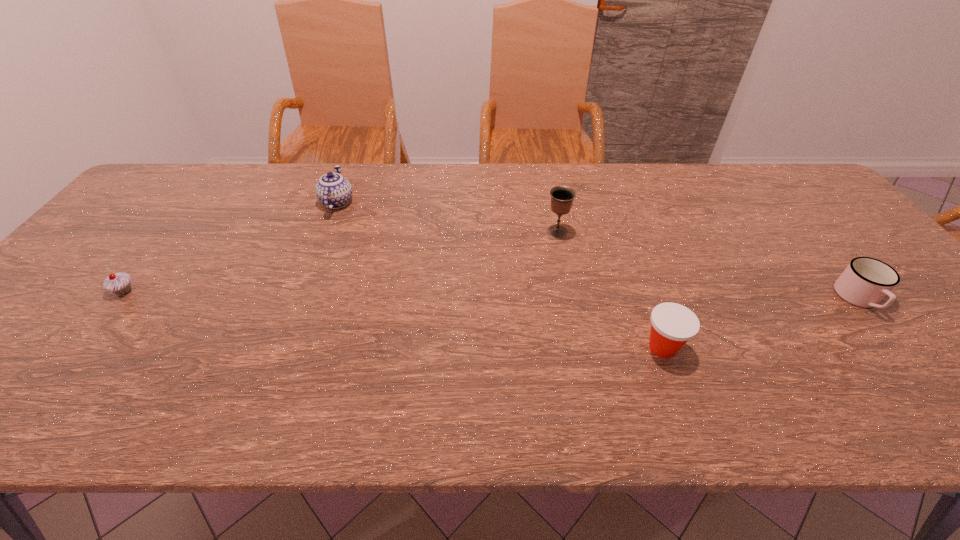
Where is `the third object from left to right`? Image resolution: width=960 pixels, height=540 pixels. the third object from left to right is located at coordinates (562, 197).

Locate an element on the screen. The width and height of the screenshot is (960, 540). the tallest object is located at coordinates (562, 197).

Identify the location of the second object from left to right. The width and height of the screenshot is (960, 540). (334, 191).

Identify the location of the farthest object. (334, 191).

The width and height of the screenshot is (960, 540). Find the location of `the nearest object`. the nearest object is located at coordinates (672, 325).

Find the location of a particular element. The width and height of the screenshot is (960, 540). the second object from right to left is located at coordinates (672, 325).

The width and height of the screenshot is (960, 540). Find the location of `cupcake`. cupcake is located at coordinates (120, 283).

Image resolution: width=960 pixels, height=540 pixels. What are the coordinates of `the rightmost object` in the screenshot? It's located at (865, 282).

Image resolution: width=960 pixels, height=540 pixels. I want to click on free space located on the back of the chalice, so click(544, 167).

The width and height of the screenshot is (960, 540). I want to click on free location located at the spout of the farthest object, so [x=350, y=170].